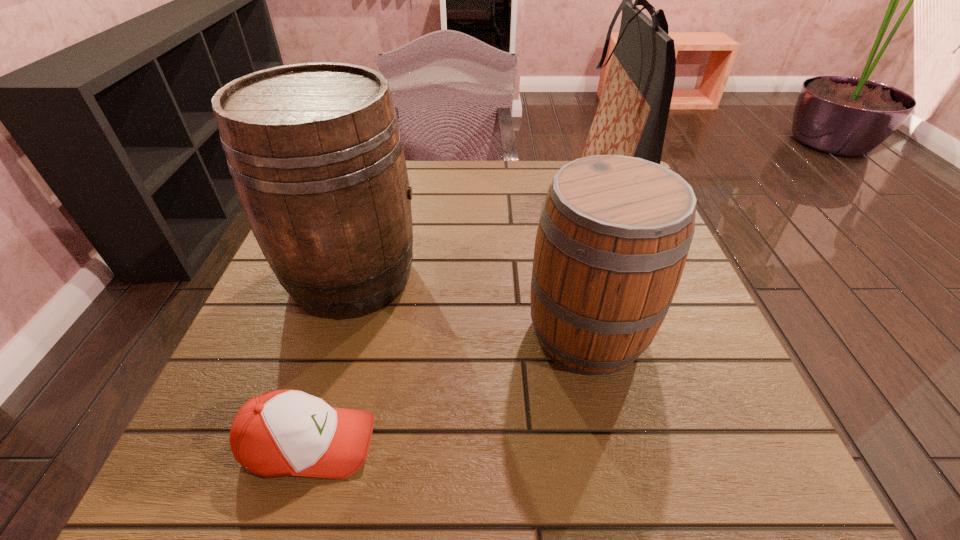
Where is `free spot between the farthest object and the second tallest object`? free spot between the farthest object and the second tallest object is located at coordinates (x=481, y=234).

Identify which object is the third nearest to the baseball cap. Please provide its 2D coordinates. Your answer should be formatted as a tuple, i.e. [(x, y)], where the tuple contains the x and y coordinates of a point satisfying the conditions above.

[(631, 118)]

The height and width of the screenshot is (540, 960). In order to click on object that is the closest one to the nearest object in this screenshot , I will do `click(316, 155)`.

Where is `vacant space that satisfies the following two spatial constraints: 1. on the side of the second shortest object near the bung hole; 2. on the right side of the left cider`? The width and height of the screenshot is (960, 540). vacant space that satisfies the following two spatial constraints: 1. on the side of the second shortest object near the bung hole; 2. on the right side of the left cider is located at coordinates (335, 332).

In order to click on blank area in the image that satisfies the following two spatial constraints: 1. on the side of the right cider near the bung hole; 2. on the left side of the left cider in this screenshot , I will do `click(335, 332)`.